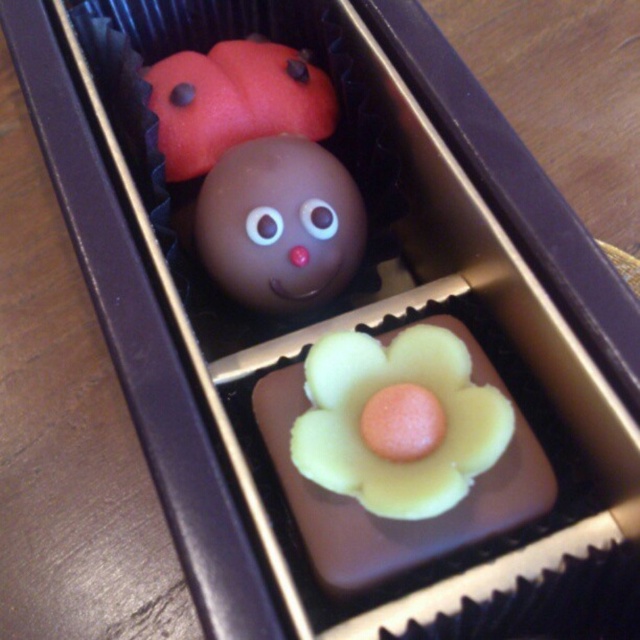
You are a small toy car that is 10 centimeters long. You are placed inside the box and want to move from the matte chocolate ladybug at upper left to the matte chocolate ball at center. Can you fit through the space between them?

The distance between the matte chocolate ball at center and the matte chocolate ladybug at upper left is 11.55 centimeters, which is greater than the toy car length of 10 centimeters. Therefore, the toy car can fit through the space between them.

You are a customer at a chocolate shop and see the matte chocolate ball at center and the matte chocolate ladybug at upper left in the box. Which confection is positioned lower in the box?

The matte chocolate ball at center is located below the matte chocolate ladybug at upper left, so it is positioned lower in the box.

What is the exact coordinate of the yellow matte flower at center?

The yellow matte flower at center is located at point (364, 406).